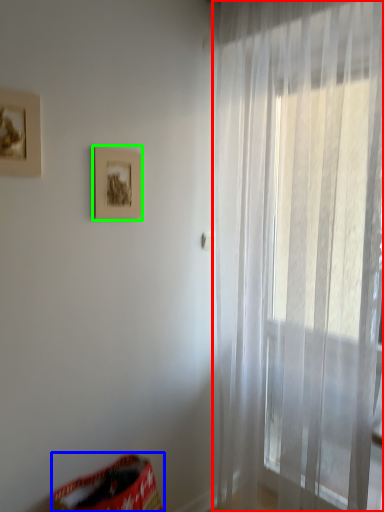
Question: Which object is positioned farthest from curtain (highlighted by a red box)? Select from bean bag chair (highlighted by a blue box) and picture frame (highlighted by a green box).

Choices:
 (A) bean bag chair
 (B) picture frame

Answer: (A)